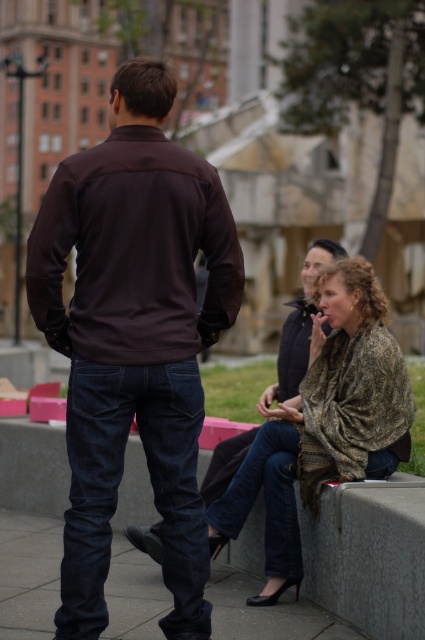
Question: Does dark brown jersey at center appear on the right side of smooth concrete pavement at lower center?

Choices:
 (A) yes
 (B) no

Answer: (A)

Question: Can you confirm if dark brown jersey at center is positioned to the left of smooth concrete pavement at lower center?

Choices:
 (A) yes
 (B) no

Answer: (B)

Question: Does dark brown jersey at center appear on the right side of smooth concrete pavement at lower center?

Choices:
 (A) no
 (B) yes

Answer: (B)

Question: Which point is closer to the camera?

Choices:
 (A) smooth concrete pavement at lower center
 (B) camouflage fabric scarf at lower right

Answer: (A)

Question: Which of the following is the farthest from the observer?

Choices:
 (A) (10, 630)
 (B) (399, 417)
 (C) (104, 394)

Answer: (B)

Question: Based on their relative distances, which object is nearer to the camouflage fabric scarf at lower right?

Choices:
 (A) dark brown jersey at center
 (B) smooth concrete pavement at lower center

Answer: (A)